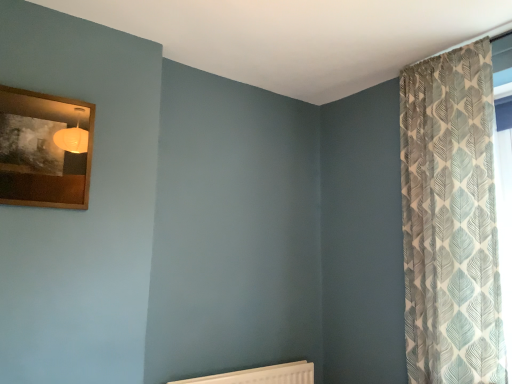
Question: From a real-world perspective, is wooden picture frame at upper left positioned over patterned fabric curtain at right based on gravity?

Choices:
 (A) yes
 (B) no

Answer: (A)

Question: Is wooden picture frame at upper left wider than patterned fabric curtain at right?

Choices:
 (A) no
 (B) yes

Answer: (A)

Question: Is wooden picture frame at upper left facing towards patterned fabric curtain at right?

Choices:
 (A) no
 (B) yes

Answer: (A)

Question: Considering the relative sizes of wooden picture frame at upper left and patterned fabric curtain at right in the image provided, is wooden picture frame at upper left thinner than patterned fabric curtain at right?

Choices:
 (A) yes
 (B) no

Answer: (A)

Question: Is wooden picture frame at upper left at the right side of patterned fabric curtain at right?

Choices:
 (A) no
 (B) yes

Answer: (A)

Question: Based on their sizes in the image, would you say wooden picture frame at upper left is bigger or smaller than white textured radiator at lower center?

Choices:
 (A) big
 (B) small

Answer: (B)

Question: Is point pyautogui.click(x=25, y=140) positioned closer to the camera than point pyautogui.click(x=187, y=382)?

Choices:
 (A) closer
 (B) farther

Answer: (A)

Question: In the image, is wooden picture frame at upper left on the left side or the right side of white textured radiator at lower center?

Choices:
 (A) left
 (B) right

Answer: (A)

Question: From a real-world perspective, is wooden picture frame at upper left above or below white textured radiator at lower center?

Choices:
 (A) below
 (B) above

Answer: (B)

Question: Considering the relative positions of wooden picture frame at upper left and patterned fabric curtain at right in the image provided, is wooden picture frame at upper left to the left or to the right of patterned fabric curtain at right?

Choices:
 (A) right
 (B) left

Answer: (B)

Question: From a real-world perspective, is wooden picture frame at upper left positioned above or below patterned fabric curtain at right?

Choices:
 (A) above
 (B) below

Answer: (A)

Question: Relative to patterned fabric curtain at right, is wooden picture frame at upper left in front or behind?

Choices:
 (A) front
 (B) behind

Answer: (A)

Question: Is wooden picture frame at upper left spatially inside patterned fabric curtain at right, or outside of it?

Choices:
 (A) outside
 (B) inside

Answer: (A)

Question: Looking at their shapes, would you say patterned fabric curtain at right is wider or thinner than wooden picture frame at upper left?

Choices:
 (A) wide
 (B) thin

Answer: (A)

Question: Looking at the image, does patterned fabric curtain at right seem bigger or smaller compared to wooden picture frame at upper left?

Choices:
 (A) big
 (B) small

Answer: (A)